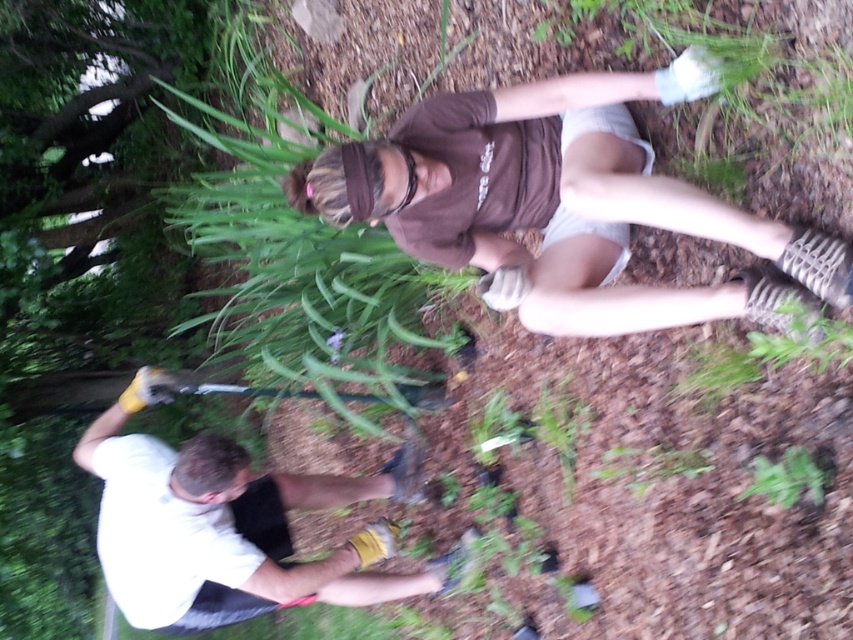
You are standing at the origin point in the garden scene. There is a brown cotton shirt at upper center represented by point (560, 204). Can you walk directly towards the shirt without any obstacles?

The brown cotton shirt at upper center is represented by point (560, 204), so yes, you can walk directly towards it as there are no obstacles mentioned in the scene description.